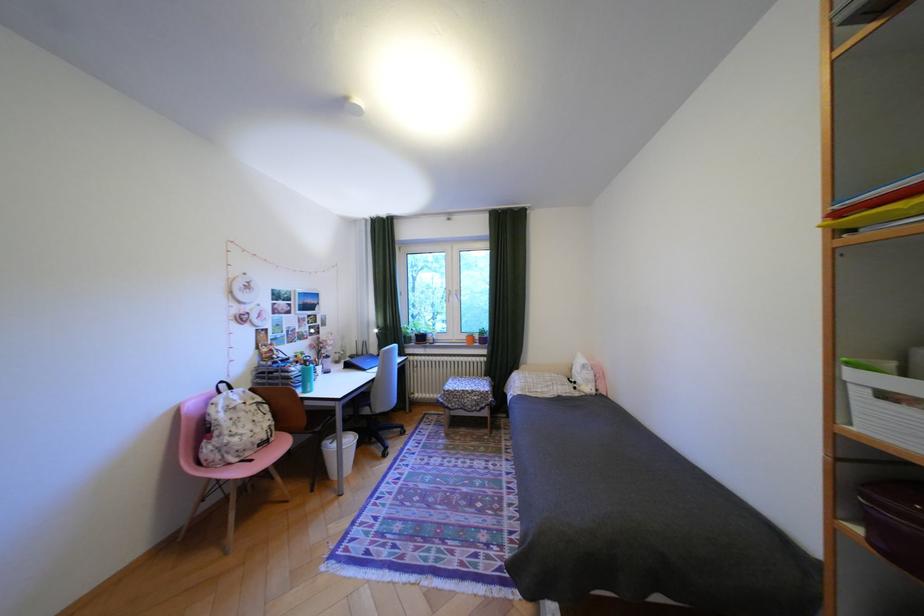
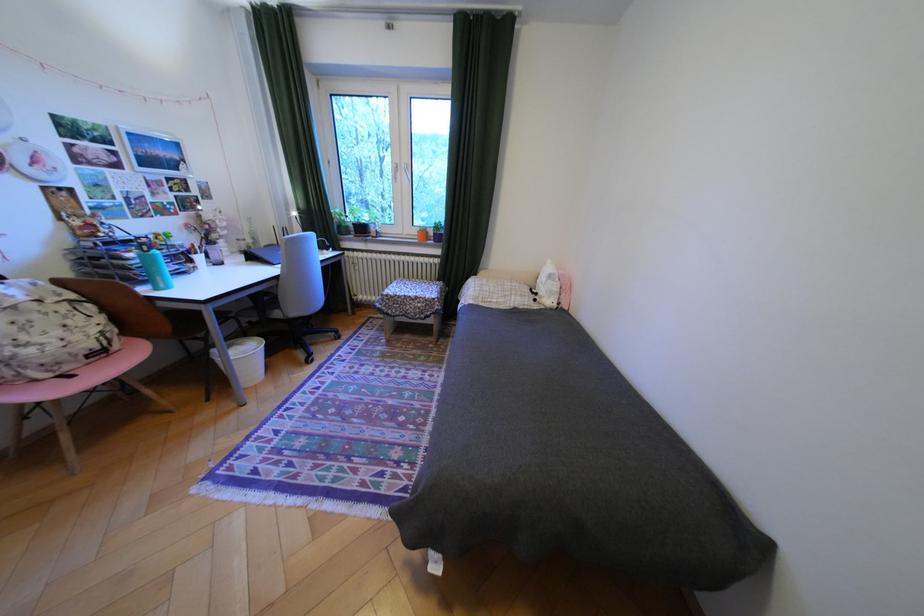
In the second image, find the point that corresponds to [463,297] in the first image.

(410, 174)